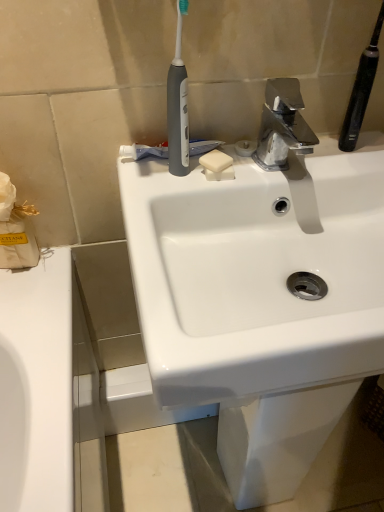
You are a GUI agent. You are given a task and a screenshot of the screen. Output one action in this format:
    pyautogui.click(x=<x>, y=<y>)
    Task: Click on the free space that is to the left of black rubberized toothbrush at upper right, placed as the 2th toothbrush when sorted from left to right
    The height and width of the screenshot is (512, 384).
    Given the screenshot: What is the action you would take?
    pyautogui.click(x=280, y=158)